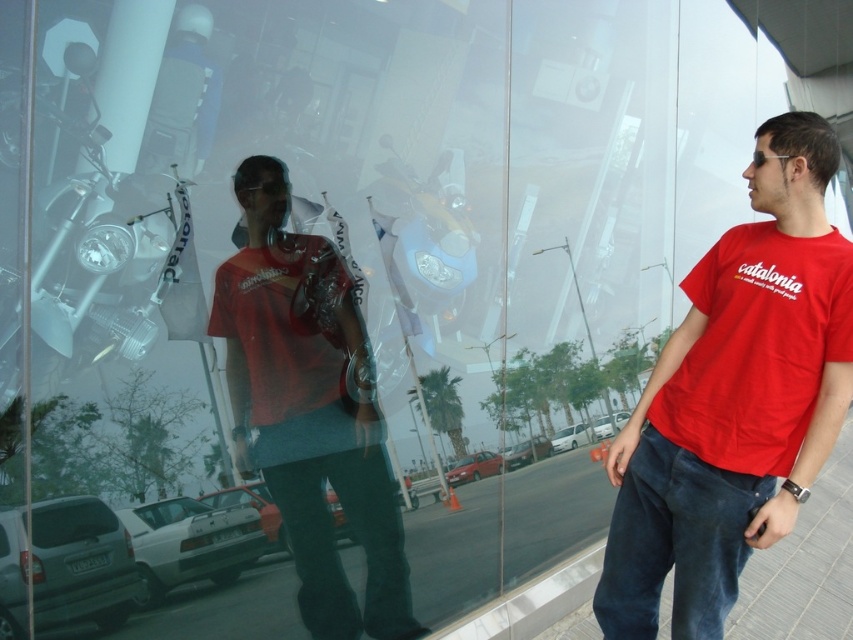
Who is shorter, gray concrete pavement at lower center or red cotton t-shirt at right?

gray concrete pavement at lower center is shorter.

Is gray concrete pavement at lower center to the right of red cotton t-shirt at right from the viewer's perspective?

No, gray concrete pavement at lower center is not to the right of red cotton t-shirt at right.

This screenshot has height=640, width=853. Describe the element at coordinates (805, 564) in the screenshot. I see `gray concrete pavement at lower center` at that location.

I want to click on gray concrete pavement at lower center, so click(x=805, y=564).

Does point (323, 588) lie in front of point (199, 586)?

No, it is behind (199, 586).

This screenshot has height=640, width=853. I want to click on matte red t-shirt at center, so click(309, 410).

Is point (393, 509) less distant than point (815, 612)?

Yes, point (393, 509) is in front of point (815, 612).

The height and width of the screenshot is (640, 853). Find the location of `matte red t-shirt at center`. matte red t-shirt at center is located at coordinates (309, 410).

Is red cotton t-shirt at center positioned before red cotton t-shirt at right?

Yes, it is.

Based on the photo, how much distance is there between red cotton t-shirt at center and red cotton t-shirt at right?

They are 2.84 inches apart.

Between point (747, 493) and point (817, 392), which one is positioned behind?

Positioned behind is point (747, 493).

Locate an element on the screen. red cotton t-shirt at center is located at coordinates (734, 397).